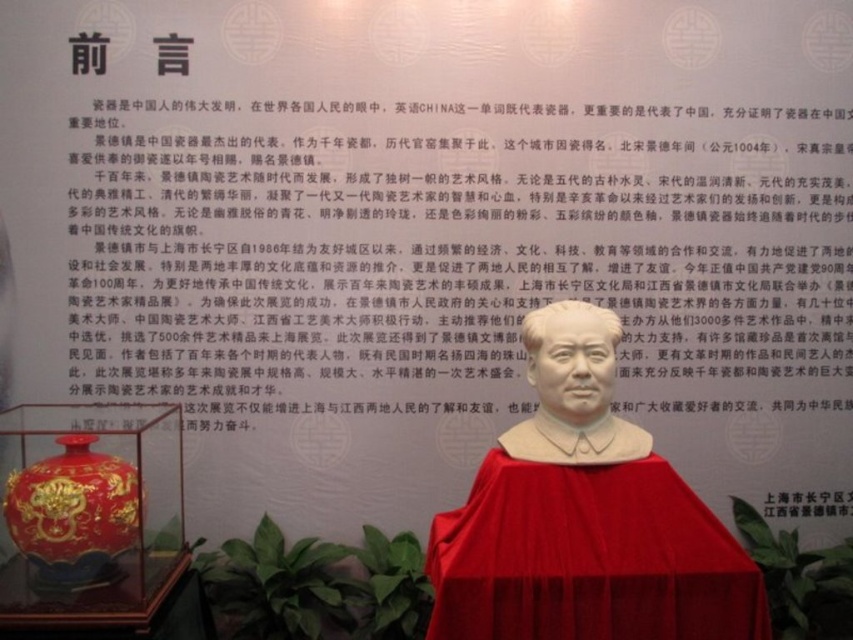
Question: Is the position of white glossy statue at center less distant than that of matte gray bust at center?

Choices:
 (A) no
 (B) yes

Answer: (B)

Question: Is white glossy statue at center thinner than matte gray bust at center?

Choices:
 (A) yes
 (B) no

Answer: (B)

Question: Which point is closer to the camera?

Choices:
 (A) (541, 566)
 (B) (596, 380)

Answer: (A)

Question: Observing the image, what is the correct spatial positioning of white glossy statue at center in reference to matte gray bust at center?

Choices:
 (A) left
 (B) right

Answer: (A)

Question: Which object is farther from the camera taking this photo?

Choices:
 (A) white glossy statue at center
 (B) matte gray bust at center

Answer: (B)